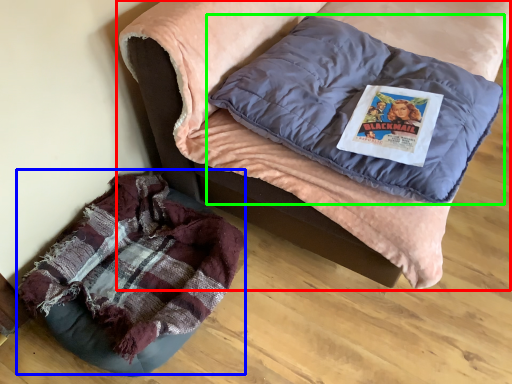
Question: Estimate the real-world distances between objects in this image. Which object is farther from furniture (highlighted by a red box), bean bag chair (highlighted by a blue box) or pillow (highlighted by a green box)?

Choices:
 (A) bean bag chair
 (B) pillow

Answer: (A)